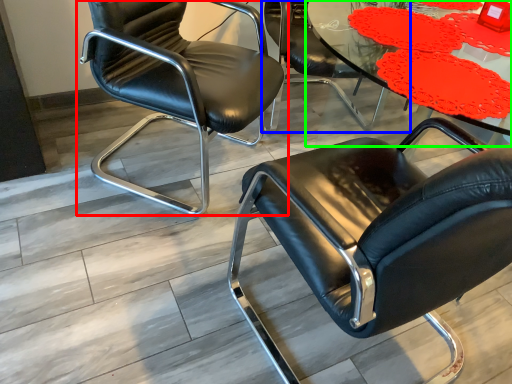
Question: Considering the real-world distances, which object is farthest from chair (highlighted by a red box)? chair (highlighted by a blue box) or table (highlighted by a green box)?

Choices:
 (A) chair
 (B) table

Answer: (B)